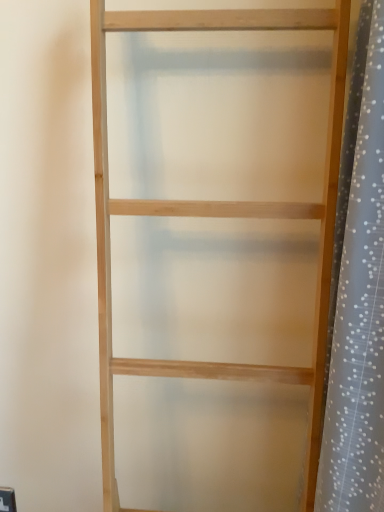
Question: Is natural wood shelf at center taller or shorter than white dotted fabric at right?

Choices:
 (A) tall
 (B) short

Answer: (A)

Question: From a real-world perspective, is natural wood shelf at center physically located above or below white dotted fabric at right?

Choices:
 (A) above
 (B) below

Answer: (B)

Question: Does point (180, 200) appear closer or farther from the camera than point (365, 45)?

Choices:
 (A) closer
 (B) farther

Answer: (B)

Question: From their relative heights in the image, would you say white dotted fabric at right is taller or shorter than natural wood shelf at center?

Choices:
 (A) tall
 (B) short

Answer: (B)

Question: From the image's perspective, is white dotted fabric at right located above or below natural wood shelf at center?

Choices:
 (A) below
 (B) above

Answer: (B)

Question: Is white dotted fabric at right in front of or behind natural wood shelf at center in the image?

Choices:
 (A) behind
 (B) front

Answer: (A)

Question: Is point (362, 168) positioned closer to the camera than point (340, 73)?

Choices:
 (A) farther
 (B) closer

Answer: (B)